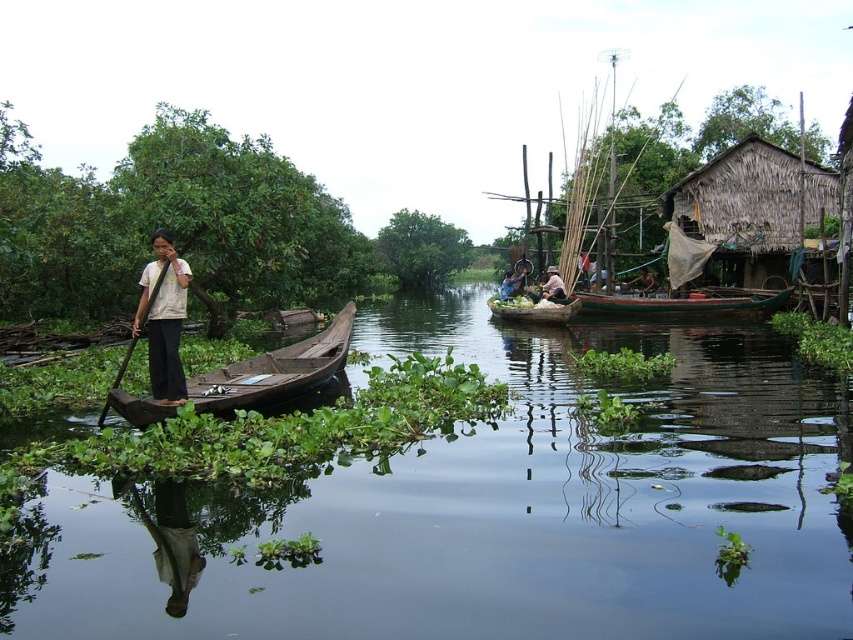
You are planning to take a boat ride on the river. You see two canoes available for use. The wooden canoe at left and the green wooden canoe at center. Which one has a bigger capacity for carrying more passengers?

The wooden canoe at left has a larger size compared to the green wooden canoe at center, so it can carry more passengers.